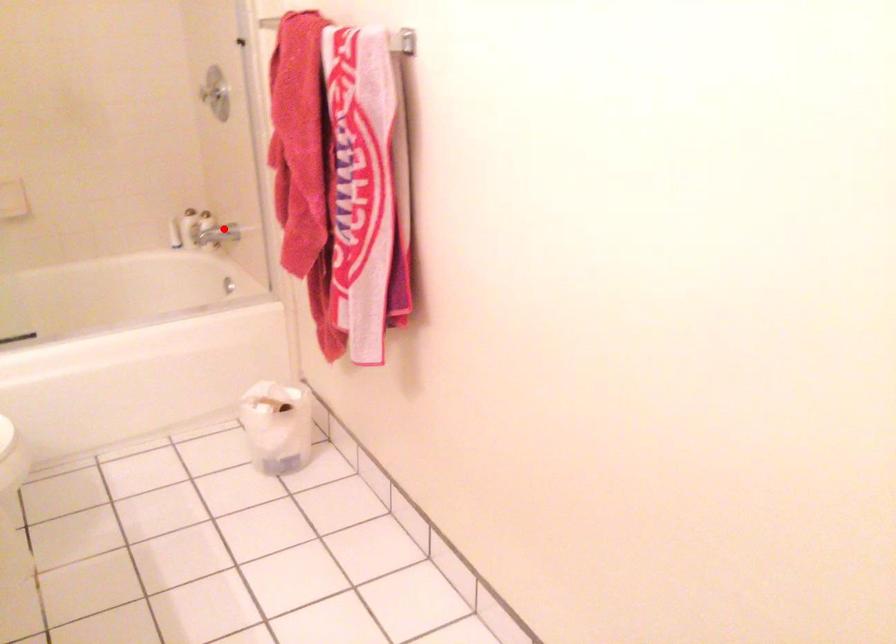
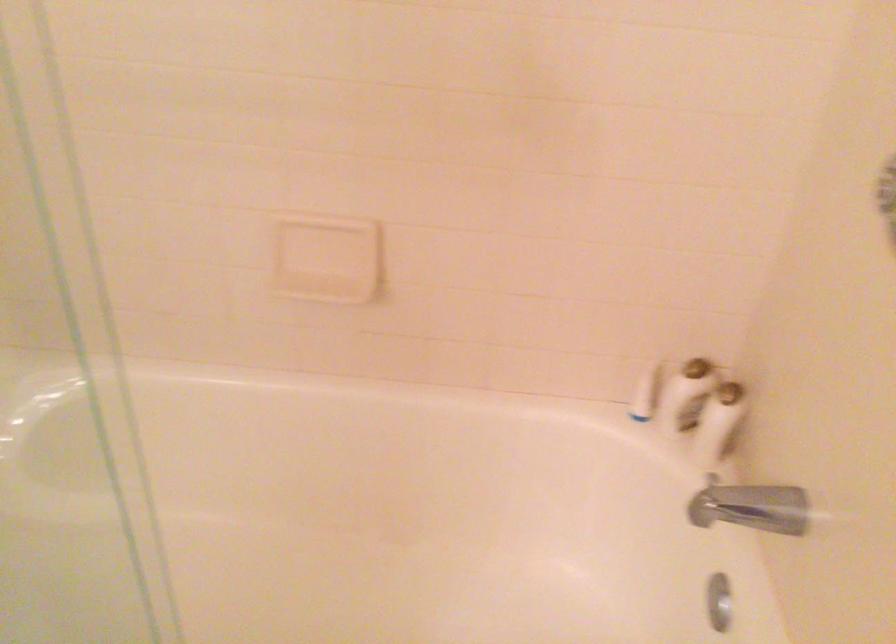
Question: I am providing you with two images of the same scene from different viewpoints. Given a red point in image1, look at the same physical point in image2. Is it:

Choices:
 (A) Closer to the viewpoint
 (B) Farther from the viewpoint

Answer: (A)